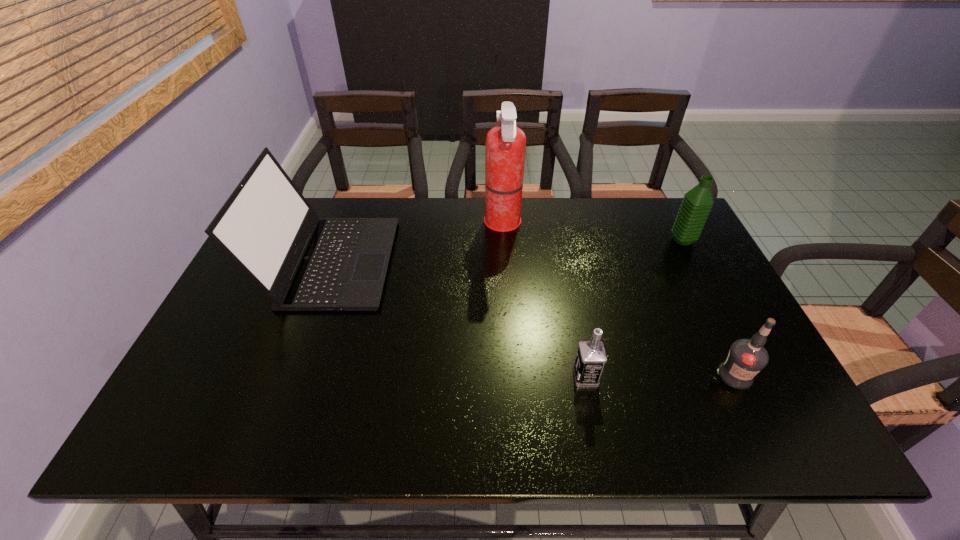
Find the location of a particular element. The image size is (960, 540). the tallest object is located at coordinates pos(505,148).

Where is `fire extinguisher`? fire extinguisher is located at coordinates (505, 148).

Image resolution: width=960 pixels, height=540 pixels. I want to click on the leftmost object, so click(x=302, y=262).

The height and width of the screenshot is (540, 960). Identify the location of the second tallest object. (302, 262).

Locate an element on the screen. The height and width of the screenshot is (540, 960). water bottle is located at coordinates (697, 203).

The width and height of the screenshot is (960, 540). I want to click on the right vodka, so click(x=746, y=358).

Identify the location of the shortest object. The image size is (960, 540). (591, 357).

Locate an element on the screen. the left vodka is located at coordinates (591, 357).

Where is `vacant space located with the handle and hose on the second object from left to right`? The image size is (960, 540). vacant space located with the handle and hose on the second object from left to right is located at coordinates (446, 224).

Where is `vacant area situated 0.090m with the handle and hose on the second object from left to right`? This screenshot has width=960, height=540. vacant area situated 0.090m with the handle and hose on the second object from left to right is located at coordinates (455, 224).